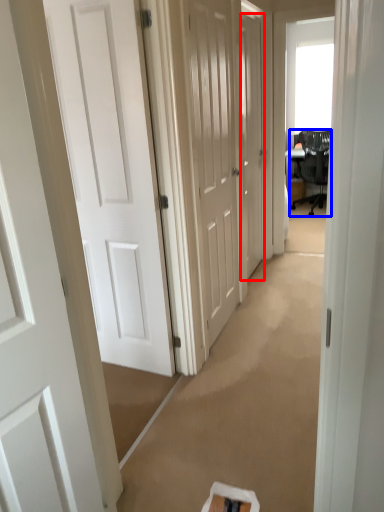
Question: Which point is further to the camera, door (highlighted by a red box) or chair (highlighted by a blue box)?

Choices:
 (A) door
 (B) chair

Answer: (B)